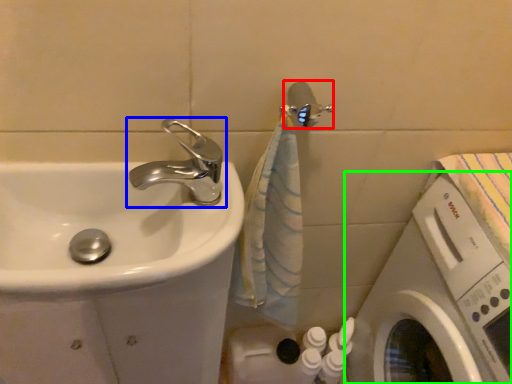
Question: Which is farther away from shower (highlighted by a red box)? tap (highlighted by a blue box) or washing machine (highlighted by a green box)?

Choices:
 (A) tap
 (B) washing machine

Answer: (B)